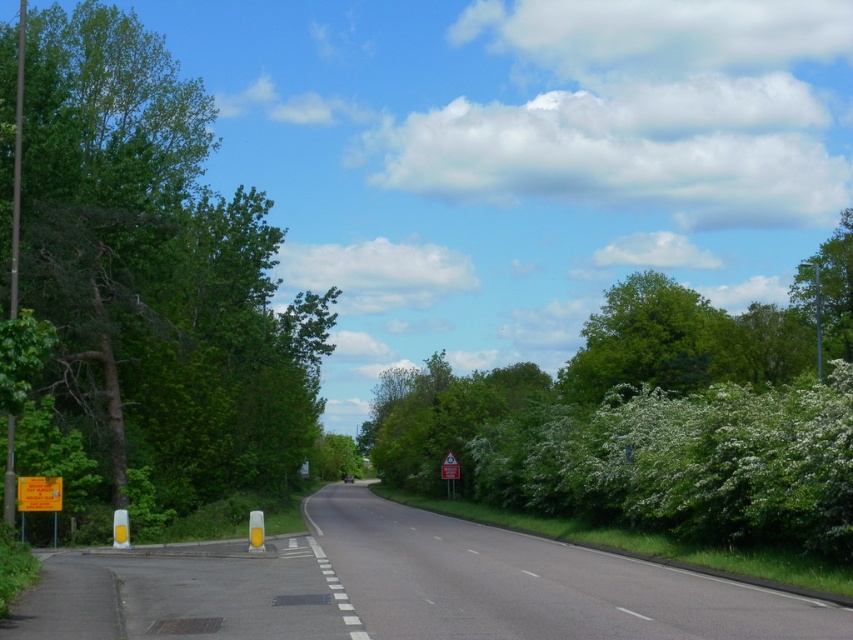
Between green leafy tree at left and green leafy tree at upper right, which one is positioned lower?

green leafy tree at upper right

Between point (184, 172) and point (851, 305), which one is positioned in front?

Positioned in front is point (184, 172).

Between point (140, 61) and point (793, 301), which one is positioned behind?

The point (793, 301) is more distant.

What are the coordinates of `green leafy tree at left` in the screenshot? It's located at (155, 273).

Which is in front, point (178, 337) or point (576, 563)?

Point (576, 563) is more forward.

Which is behind, point (74, 19) or point (257, 577)?

The point (74, 19) is more distant.

Locate an element on the screen. This screenshot has height=640, width=853. green leafy tree at left is located at coordinates (155, 273).

Which of these two, asphalt road at center or green leafy tree at upper right, stands taller?

green leafy tree at upper right is taller.

Measure the distance between asphalt road at center and camera.

asphalt road at center and camera are 10.56 meters apart.

This screenshot has height=640, width=853. Identify the location of asphalt road at center. (398, 588).